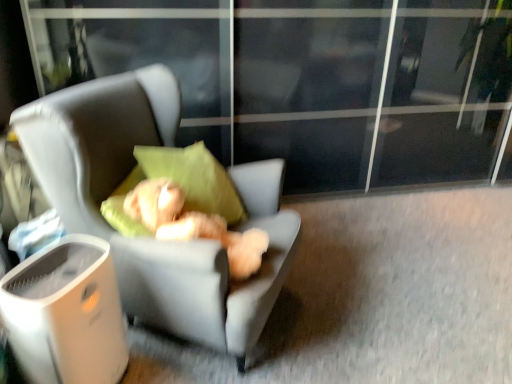
Question: Does soft gray fabric chair at center have a greater width compared to fluffy beige teddy bear at center?

Choices:
 (A) no
 (B) yes

Answer: (B)

Question: Does soft gray fabric chair at center have a lesser width compared to fluffy beige teddy bear at center?

Choices:
 (A) yes
 (B) no

Answer: (B)

Question: Is soft gray fabric chair at center positioned with its back to fluffy beige teddy bear at center?

Choices:
 (A) yes
 (B) no

Answer: (A)

Question: Is soft gray fabric chair at center smaller than fluffy beige teddy bear at center?

Choices:
 (A) yes
 (B) no

Answer: (B)

Question: From the image's perspective, is soft gray fabric chair at center above fluffy beige teddy bear at center?

Choices:
 (A) yes
 (B) no

Answer: (A)

Question: Is soft gray fabric chair at center aimed at fluffy beige teddy bear at center?

Choices:
 (A) yes
 (B) no

Answer: (A)

Question: From a real-world perspective, is soft gray fabric chair at center on top of white plastic trash bin at lower left?

Choices:
 (A) no
 (B) yes

Answer: (B)

Question: Could white plastic trash bin at lower left be considered to be inside soft gray fabric chair at center?

Choices:
 (A) no
 (B) yes

Answer: (A)

Question: From a real-world perspective, is soft gray fabric chair at center physically below white plastic trash bin at lower left?

Choices:
 (A) yes
 (B) no

Answer: (B)

Question: Considering the relative positions of soft gray fabric chair at center and white plastic trash bin at lower left in the image provided, is soft gray fabric chair at center to the right of white plastic trash bin at lower left from the viewer's perspective?

Choices:
 (A) yes
 (B) no

Answer: (A)

Question: Can you confirm if soft gray fabric chair at center is positioned to the left of white plastic trash bin at lower left?

Choices:
 (A) no
 (B) yes

Answer: (A)

Question: Could you tell me if soft gray fabric chair at center is facing white plastic trash bin at lower left?

Choices:
 (A) yes
 (B) no

Answer: (B)

Question: Does white plastic trash bin at lower left have a larger size compared to soft gray fabric chair at center?

Choices:
 (A) yes
 (B) no

Answer: (B)